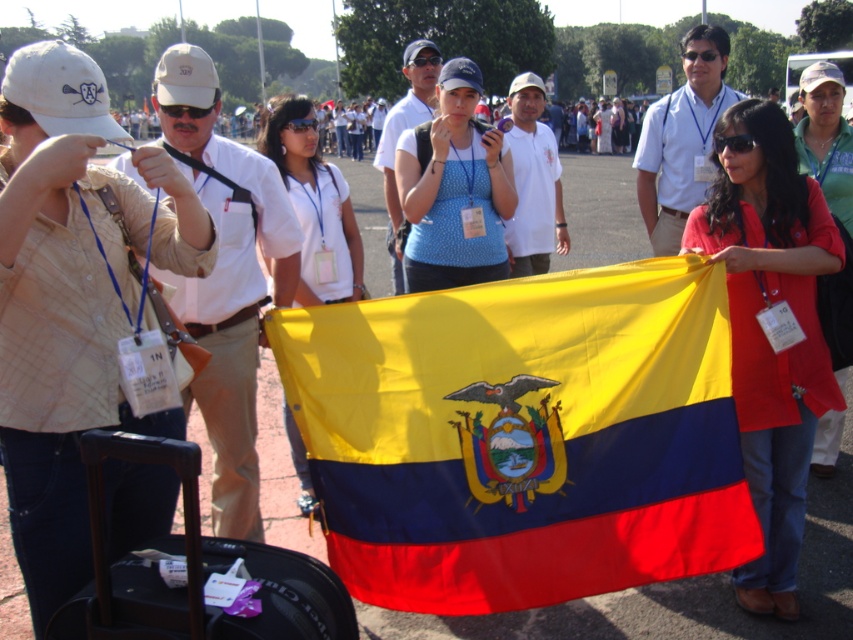
You are at an event and need to retrieve your black hard suitcase at lower left. You are currently standing near the matte white shirt at center. Which direction should you move to reach your suitcase?

The black hard suitcase at lower left is to the left of the matte white shirt at center, so you should move to your left to reach it.

You are organizing an outdoor event and need to place a black hard suitcase at lower left and a matte white shirt at center. Which object requires more storage space?

The black hard suitcase at lower left requires more storage space because it is bigger than the matte white shirt at center.

You are a photographer at the event and need to capture a photo that includes both the polyester flag at center and the matte red jacket at center. Based on their sizes, which object should you position closer to the camera to ensure both fit in the frame?

The polyester flag at center is wider than the matte red jacket at center. To ensure both fit in the frame, position the polyester flag at center closer to the camera since its larger size requires more space in the photo.